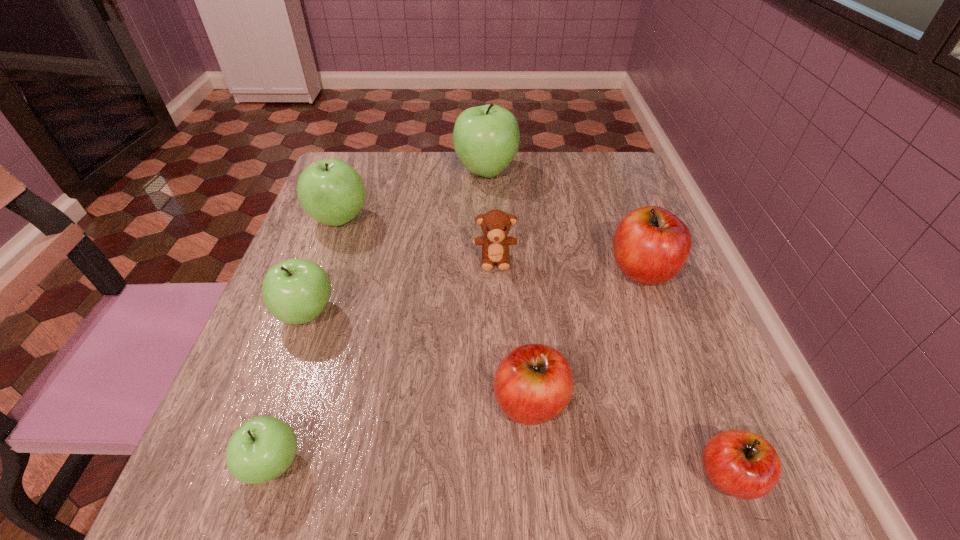
Image resolution: width=960 pixels, height=540 pixels. In order to click on the smallest red apple in this screenshot , I will do `click(742, 464)`.

Find the location of a particular element. vacant space located on the right of the farthest object is located at coordinates (620, 171).

The width and height of the screenshot is (960, 540). Find the location of `vacant space located on the back of the seventh nearest object`. vacant space located on the back of the seventh nearest object is located at coordinates (358, 168).

The height and width of the screenshot is (540, 960). Identify the location of free region located 0.120m on the left of the farthest red apple. (549, 270).

Where is `vacant region located 0.120m on the front of the second nearest green apple`? Image resolution: width=960 pixels, height=540 pixels. vacant region located 0.120m on the front of the second nearest green apple is located at coordinates (276, 400).

What are the coordinates of `vacant space located on the left of the second smallest red apple` in the screenshot? It's located at (409, 402).

Identify the location of free space located on the face of the brown teddy bear. (499, 384).

The height and width of the screenshot is (540, 960). I want to click on vacant space located 0.190m on the right of the smallest green apple, so click(x=439, y=464).

I want to click on free location located on the left of the nearest red apple, so click(x=414, y=476).

At what (x,y) coordinates should I click in order to perform the action: click on object located in the far left corner section of the desktop. Please return your answer as a coordinate pair (x, y). The image size is (960, 540). Looking at the image, I should click on (330, 191).